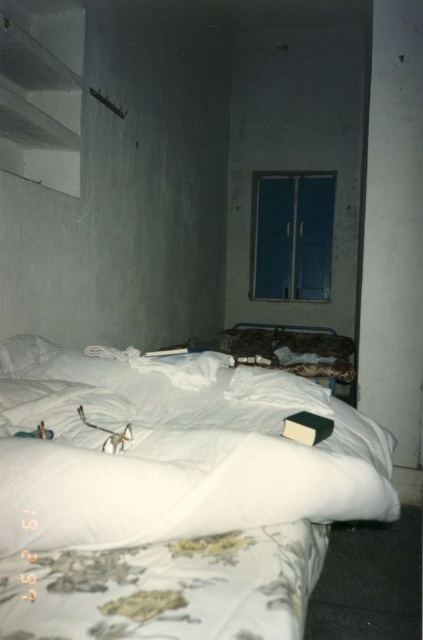
You are a delivery robot with a box that is 24 inches long. You need to place the box between the white fabric bed at center and the white soft pillow at upper left. Can the box fit in that space?

The distance between the white fabric bed at center and the white soft pillow at upper left is 22.10 inches. Since the box is 24 inches long, it cannot fit in the space between them.

You are standing in the room depicted in the image. You want to move from the blue door to the white fabric bed at center. Which direction should you move in to reach the bed?

Since the white fabric bed at center is located at point (x=173, y=499) in the image, you should move towards the center of the room to reach it from the blue door.

Based on the photo, you are standing in the room and want to reach the point at coordinates [184,513]. If your arm can reach 36 inches, can you reach that point without moving?

The point at [184,513] is 34.96 inches away from you, so yes, you can reach it with your arm since it is within the 36 inches range.